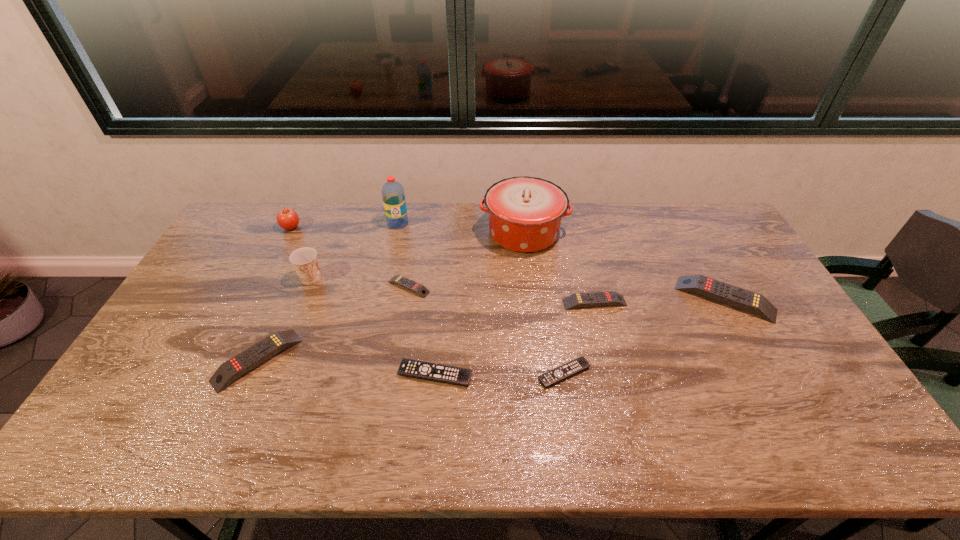
Locate an element on the screen. This screenshot has width=960, height=540. free point between the orange Dixie cup and the sixth shortest object is located at coordinates (517, 289).

The height and width of the screenshot is (540, 960). I want to click on vacant region between the apple and the second tallest remote control, so click(x=275, y=294).

Find the location of a particular element. free spot between the right black remote control and the third yellow remote control from left to right is located at coordinates (579, 338).

Image resolution: width=960 pixels, height=540 pixels. I want to click on vacant space that's between the third yellow remote control from right to left and the water bottle, so click(403, 255).

Select which object appears as the eighth closest to the right black remote control. Please provide its 2D coordinates. Your answer should be formatted as a tuple, i.e. [(x, y)], where the tuple contains the x and y coordinates of a point satisfying the conditions above.

[(304, 260)]

At what (x,y) coordinates should I click in order to perform the action: click on object identified as the second closest to the casserole. Please return your answer as a coordinate pair (x, y). This screenshot has width=960, height=540. Looking at the image, I should click on (419, 289).

Point out which remote control is positioned as the nearest to the smallest yellow remote control. Please provide its 2D coordinates. Your answer should be formatted as a tuple, i.e. [(x, y)], where the tuple contains the x and y coordinates of a point satisfying the conditions above.

[(453, 375)]

This screenshot has height=540, width=960. I want to click on the second closest remote control to the smallest yellow remote control, so click(x=250, y=358).

I want to click on the fourth closest yellow remote control to the shortest object, so click(x=250, y=358).

Identify which yellow remote control is the closest to the fourth shortest remote control. Please provide its 2D coordinates. Your answer should be formatted as a tuple, i.e. [(x, y)], where the tuple contains the x and y coordinates of a point satisfying the conditions above.

[(732, 295)]